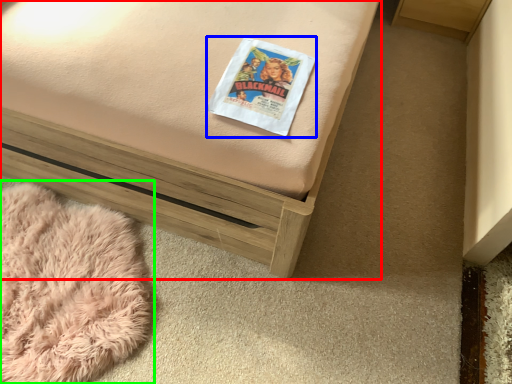
Question: Estimate the real-world distances between objects in this image. Which object is closer to furniture (highlighted by a red box), paperback book (highlighted by a blue box) or blanket (highlighted by a green box)?

Choices:
 (A) paperback book
 (B) blanket

Answer: (A)